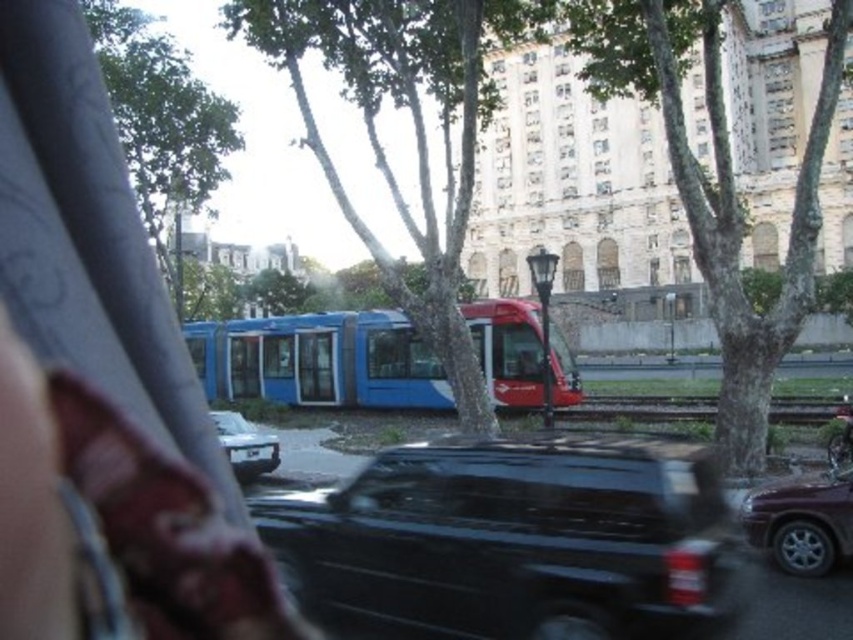
Is shiny black suv at center thinner than white glossy car at center?

In fact, shiny black suv at center might be wider than white glossy car at center.

Find the location of a particular element. The height and width of the screenshot is (640, 853). shiny black suv at center is located at coordinates (515, 540).

Image resolution: width=853 pixels, height=640 pixels. What are the coordinates of `shiny black suv at center` in the screenshot? It's located at (515, 540).

This screenshot has width=853, height=640. What are the coordinates of `shiny black suv at center` in the screenshot? It's located at (515, 540).

Does smooth bark tree at center have a greater height compared to shiny maroon suv at lower right?

Indeed, smooth bark tree at center has a greater height compared to shiny maroon suv at lower right.

This screenshot has height=640, width=853. What do you see at coordinates (717, 186) in the screenshot?
I see `smooth bark tree at center` at bounding box center [717, 186].

Where is `smooth bark tree at center`? The height and width of the screenshot is (640, 853). smooth bark tree at center is located at coordinates (717, 186).

Is blue matte bus at center taller than shiny maroon suv at lower right?

Correct, blue matte bus at center is much taller as shiny maroon suv at lower right.

From the picture: Is blue matte bus at center further to camera compared to shiny maroon suv at lower right?

Yes, blue matte bus at center is further from the viewer.

Which is behind, point (213, 356) or point (844, 497)?

The point (213, 356) is behind.

Locate an element on the screen. blue matte bus at center is located at coordinates (318, 360).